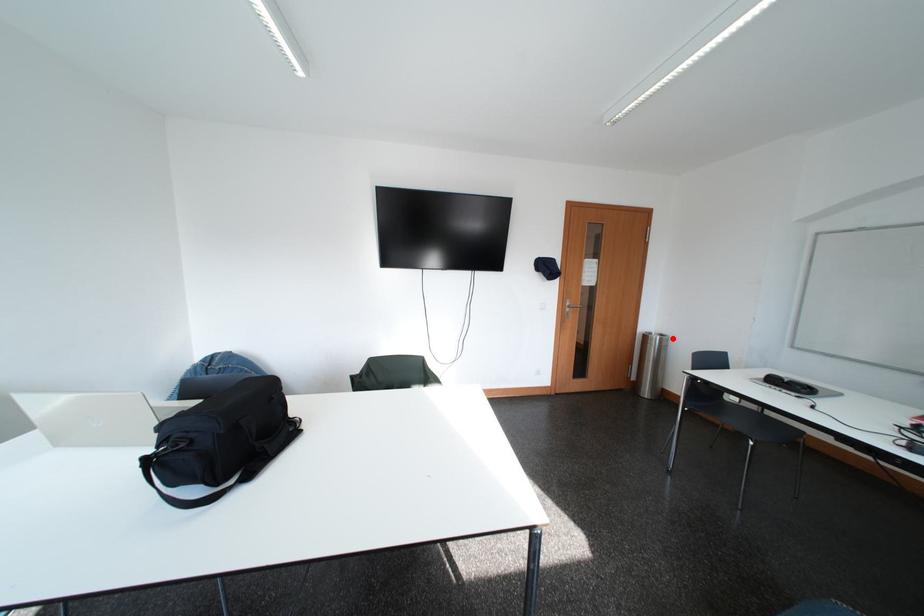
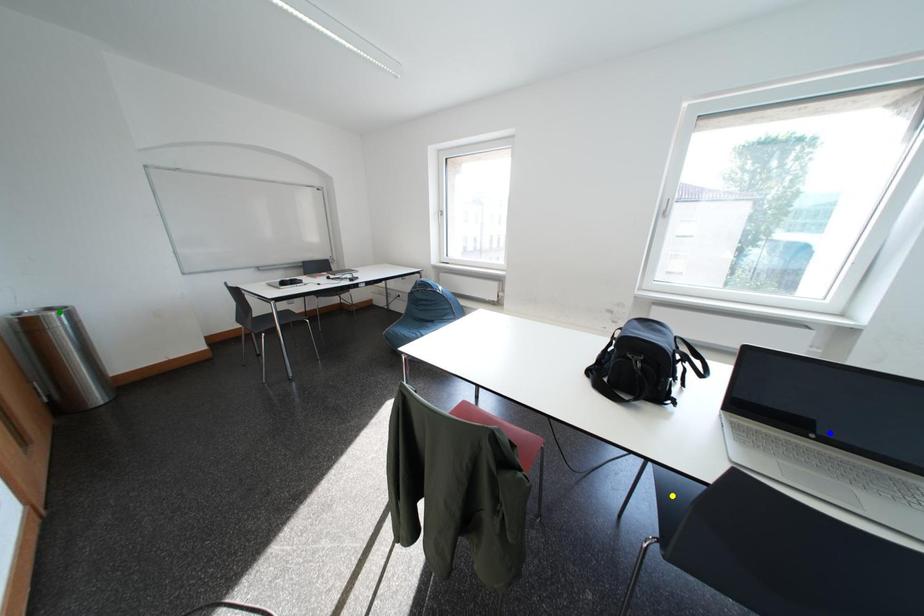
Question: I am providing you with two images of the same scene from different viewpoints. A red point is marked on the first image. You are given multiple points on the second image. Which point in image 2 represents the same 3d spot as the red point in image 1?

Choices:
 (A) blue point
 (B) green point
 (C) yellow point

Answer: (B)